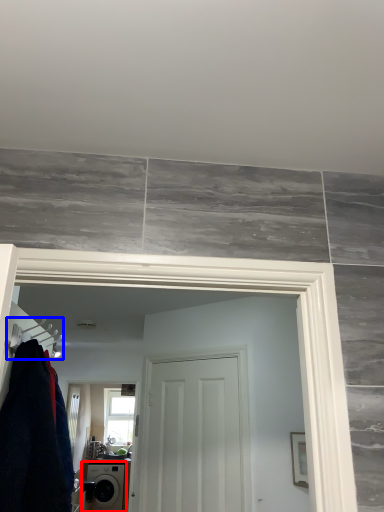
Question: Which object is closer to the camera taking this photo, washing machine (highlighted by a red box) or hanger (highlighted by a blue box)?

Choices:
 (A) washing machine
 (B) hanger

Answer: (B)